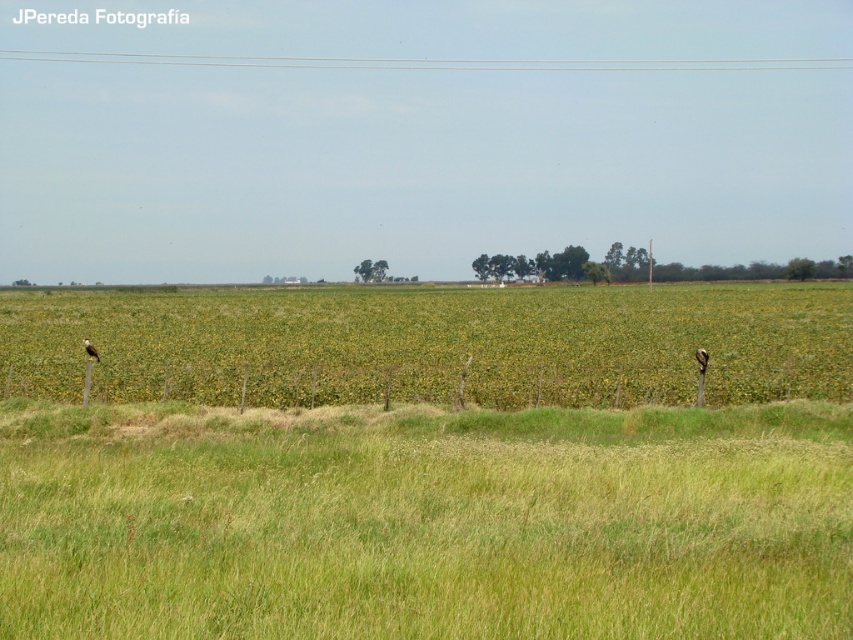
Question: Does green grassy field at lower center appear on the right side of green grass at center?

Choices:
 (A) yes
 (B) no

Answer: (B)

Question: Does green grassy field at lower center appear on the left side of green grass at center?

Choices:
 (A) yes
 (B) no

Answer: (A)

Question: Among these objects, which one is farthest from the camera?

Choices:
 (A) green grass at center
 (B) green grassy field at lower center

Answer: (A)

Question: Which point appears closest to the camera in this image?

Choices:
 (A) (809, 584)
 (B) (238, 323)

Answer: (A)

Question: Where is green grassy field at lower center located in relation to green grass at center in the image?

Choices:
 (A) below
 (B) above

Answer: (A)